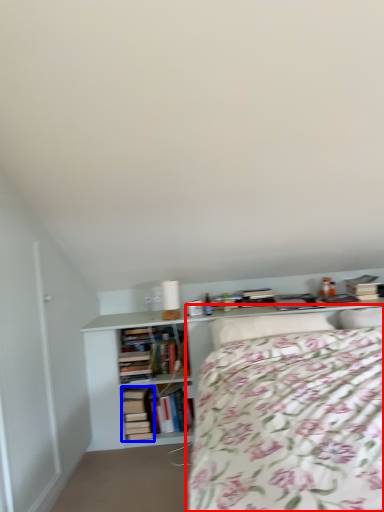
Question: Which point is further to the camera, bed (highlighted by a red box) or book (highlighted by a blue box)?

Choices:
 (A) bed
 (B) book

Answer: (B)